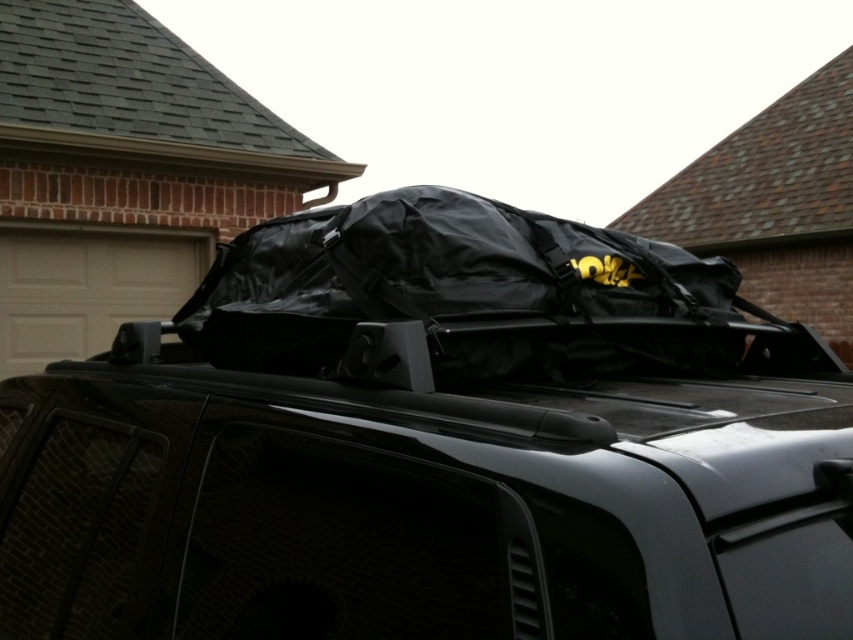
At what (x,y) coordinates should I click in order to perform the action: click on gray shingles at upper left. Please return your answer as a coordinate pair (x, y). Looking at the image, I should click on (135, 90).

Who is shorter, gray shingles at upper left or brown shingles at upper right?

brown shingles at upper right

Does point (131, 68) lie in front of point (828, 134)?

Yes.

I want to click on gray shingles at upper left, so click(x=135, y=90).

Does black matte luggage at center appear on the left side of black rubberized bag at center?

Correct, you'll find black matte luggage at center to the left of black rubberized bag at center.

Which of these two, black matte luggage at center or black rubberized bag at center, stands taller?

black matte luggage at center

Is point (534, 572) positioned before point (451, 204)?

Yes, it is.

Image resolution: width=853 pixels, height=640 pixels. What are the coordinates of `black matte luggage at center` in the screenshot? It's located at (426, 497).

Can you confirm if black rubberized bag at center is wider than brown shingles at upper right?

Yes, black rubberized bag at center is wider than brown shingles at upper right.

Which of these two, black rubberized bag at center or brown shingles at upper right, stands shorter?

black rubberized bag at center is shorter.

Find the location of a particular element. black rubberized bag at center is located at coordinates (457, 291).

Where is `black rubberized bag at center`? black rubberized bag at center is located at coordinates (457, 291).